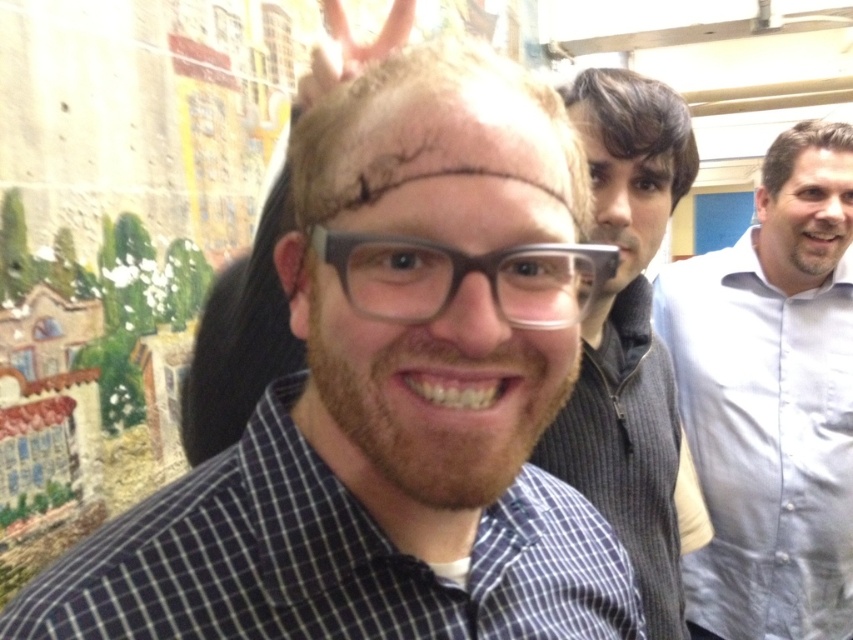
Is light blue shirt at right bigger than gray matte hair at upper right?

Yes, light blue shirt at right is bigger than gray matte hair at upper right.

Image resolution: width=853 pixels, height=640 pixels. Identify the location of light blue shirt at right. (772, 400).

Find the location of a particular element. light blue shirt at right is located at coordinates (772, 400).

Who is taller, gray ribbed sweater at center or gray matte hair at upper right?

With more height is gray ribbed sweater at center.

Does gray ribbed sweater at center have a smaller size compared to gray matte hair at upper right?

Incorrect, gray ribbed sweater at center is not smaller in size than gray matte hair at upper right.

Is point (602, 317) positioned in front of point (796, 125)?

Yes, point (602, 317) is in front of point (796, 125).

In order to click on gray ribbed sweater at center in this screenshot , I will do `click(630, 336)`.

Which of these two, light blue shirt at right or transparent plastic glasses at center, stands taller?

With more height is light blue shirt at right.

Does light blue shirt at right have a lesser height compared to transparent plastic glasses at center?

Incorrect, light blue shirt at right's height does not fall short of transparent plastic glasses at center's.

Describe the element at coordinates (772, 400) in the screenshot. I see `light blue shirt at right` at that location.

Where is `light blue shirt at right`? light blue shirt at right is located at coordinates (772, 400).